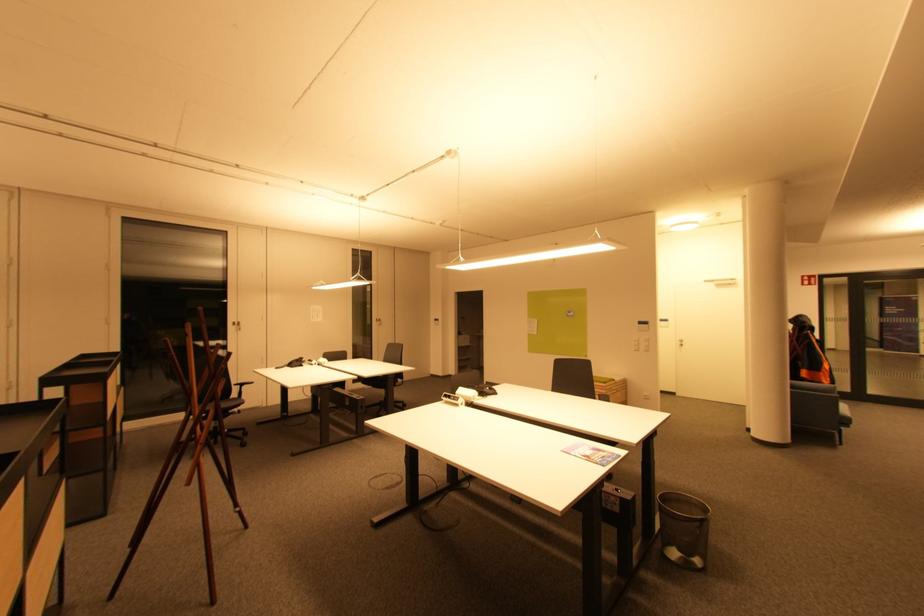
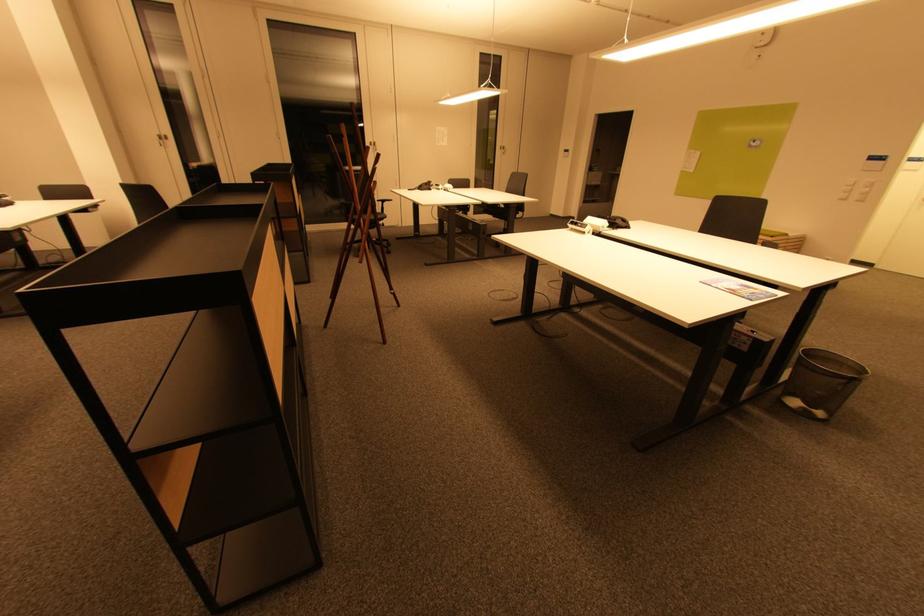
Where in the second image is the point corresponding to (x=608, y=383) from the first image?

(775, 236)